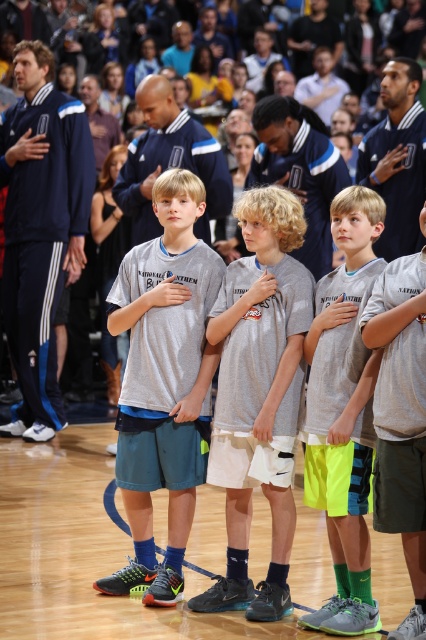
Is gray matte jersey at center to the right of neon green shorts at center from the viewer's perspective?

No, gray matte jersey at center is not to the right of neon green shorts at center.

Is point (232, 308) farther from viewer compared to point (419, 484)?

Yes, point (232, 308) is farther from viewer.

What do you see at coordinates (259, 394) in the screenshot?
I see `gray matte jersey at center` at bounding box center [259, 394].

This screenshot has width=426, height=640. I want to click on gray matte jersey at center, so click(259, 394).

Based on the photo, who is higher up, gray fabric shirt at center or gray matte jersey at center?

gray fabric shirt at center

Measure the distance from gray fabric shirt at center to gray matte jersey at center.

gray fabric shirt at center and gray matte jersey at center are 41.16 centimeters apart.

Identify the location of gray fabric shirt at center. (164, 384).

Is gray fabric shirt at center thinner than neon green shorts at center?

No, gray fabric shirt at center is not thinner than neon green shorts at center.

What do you see at coordinates (164, 384) in the screenshot? The width and height of the screenshot is (426, 640). I see `gray fabric shirt at center` at bounding box center [164, 384].

Is point (176, 380) behind point (420, 412)?

Yes.

Locate an element on the screen. The width and height of the screenshot is (426, 640). gray fabric shirt at center is located at coordinates pos(164,384).